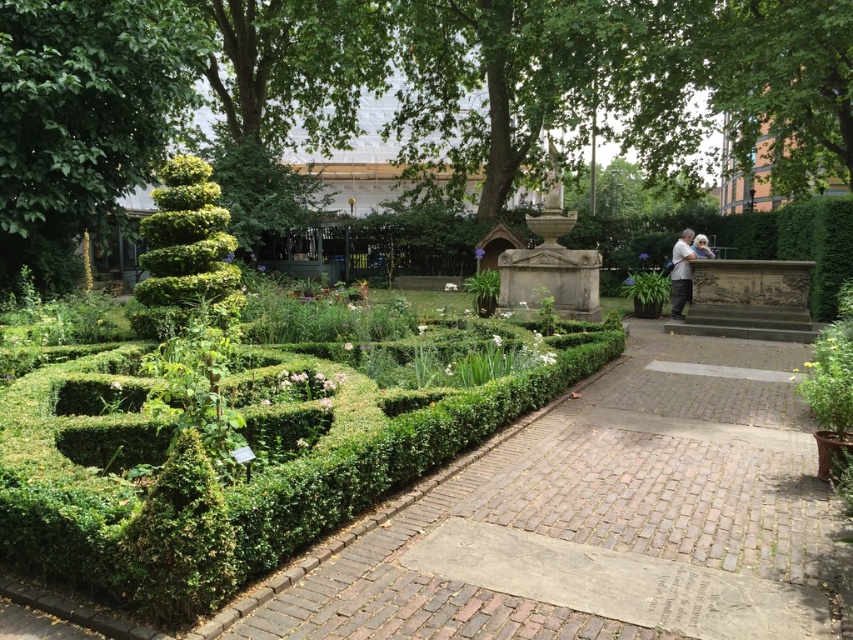
Question: Which point is closer to the camera taking this photo?

Choices:
 (A) (677, 292)
 (B) (144, 316)
 (C) (16, 204)

Answer: (B)

Question: Which point is closer to the camera?

Choices:
 (A) (227, 531)
 (B) (698, 252)
 (C) (672, 253)
 (D) (795, 483)

Answer: (A)

Question: Can you confirm if green leafy tree at center is bigger than white hair at upper right?

Choices:
 (A) no
 (B) yes

Answer: (B)

Question: Which of the following is the closest to the observer?

Choices:
 (A) (498, 211)
 (B) (701, 248)

Answer: (B)

Question: Is green textured bush at lower left above green leafy bush at left?

Choices:
 (A) no
 (B) yes

Answer: (A)

Question: Does green leafy tree at center have a smaller size compared to white hair at upper right?

Choices:
 (A) yes
 (B) no

Answer: (B)